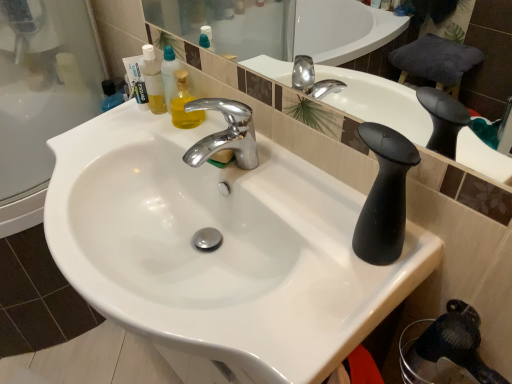
Identify the location of free location to the left of white matte toothpaste tube at upper left. The image size is (512, 384). (100, 123).